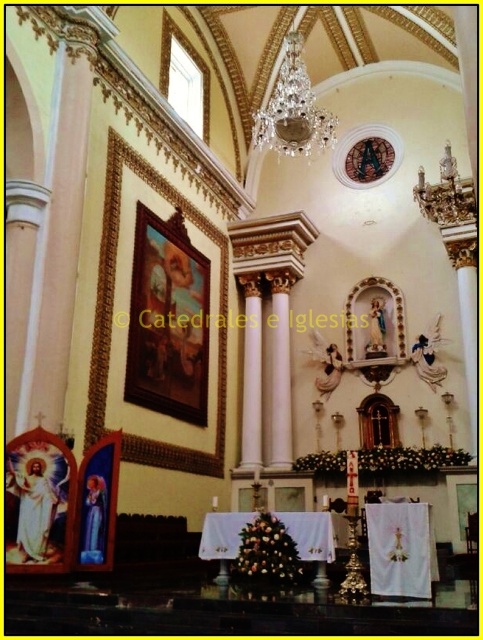
You are an interior designer assessing the church layout. You need to determine if the wooden framed painting at upper left can be moved to the position currently occupied by the crystal glass chandelier at upper center. Based on their dimensions, would this be feasible?

The wooden framed painting at upper left is thinner than the crystal glass chandelier at upper center, so it can be moved there as it would fit within the space available.

You are standing at the entrance of the grand church and want to take a photo of both the wooden framed painting at upper left and the crystal glass chandelier at upper center. Given that your camera has a maximum zoom range of 18 meters, will you be able to capture both objects in a single frame without moving closer?

The wooden framed painting at upper left is 19.25 meters away from the crystal glass chandelier at upper center. Since your camera can only zoom up to 18 meters, you won cannot capture both in a single frame without moving closer.